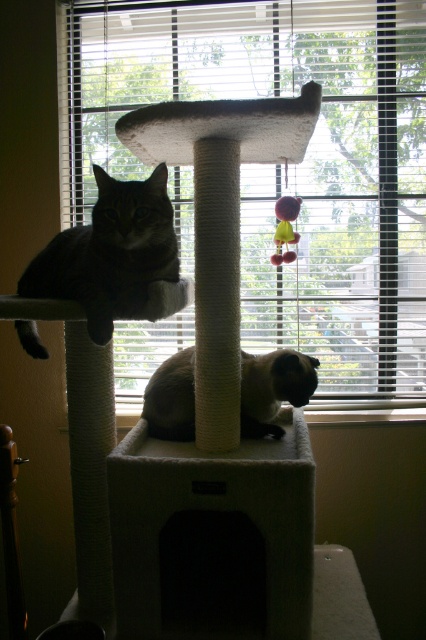
You are a cat trying to reach the plush yellow catnip toy at center from the white carpeted cat tree at center. Which direction should you move to get closer to the toy?

The white carpeted cat tree at center is closer to the viewer than the plush yellow catnip toy at center, so to reach the toy, you should move backward away from the viewer towards it.

You are a cat owner who wants to ensure your cats can reach their favorite toy. The cats are currently on the white carpeted cat tree at center. Can they easily reach the plush yellow catnip toy at center from their current position?

The white carpeted cat tree at center has a greater height compared to plush yellow catnip toy at center, so the cats on the higher platform can easily reach the plush yellow catnip toy at center by jumping down from their current position.